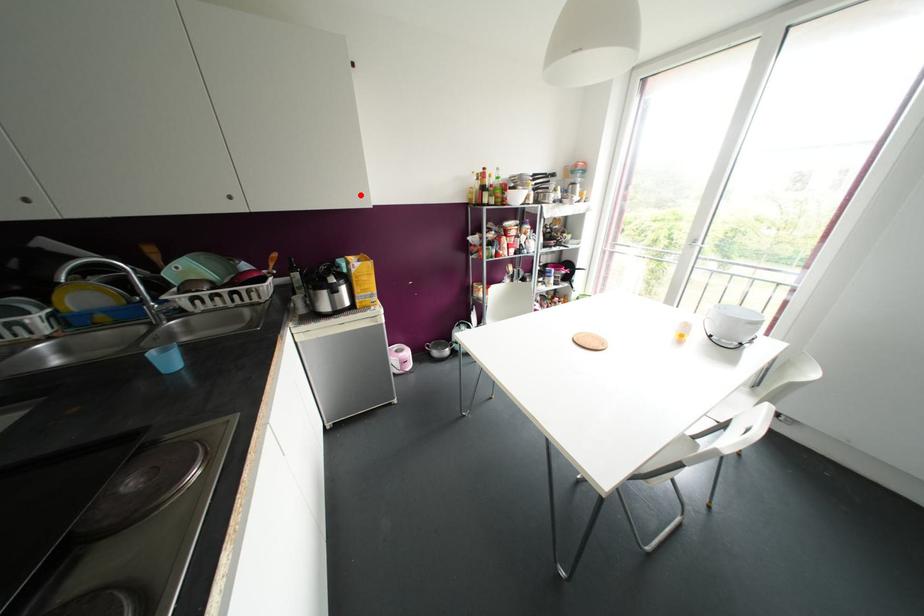
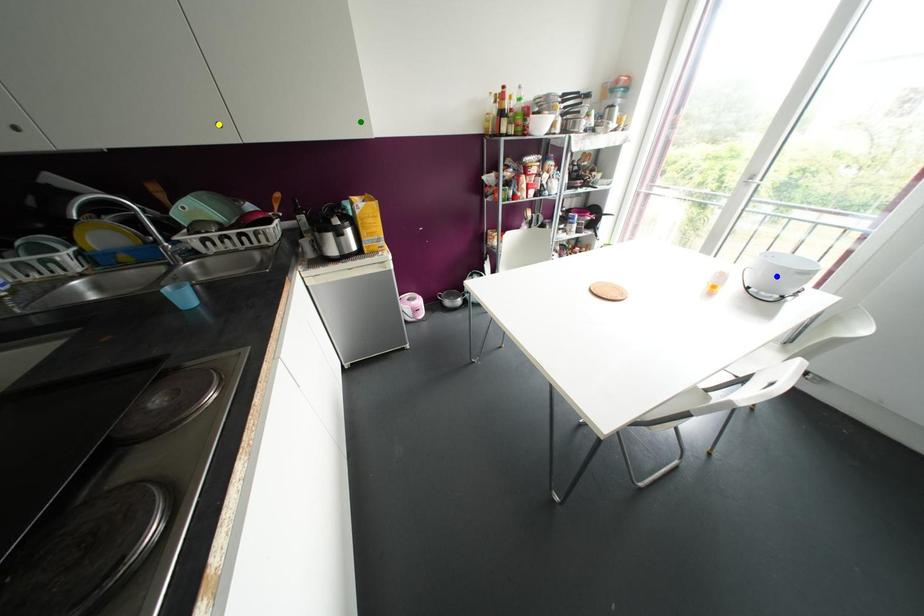
Question: I am providing you with two images of the same scene from different viewpoints. A red point is marked on the first image. You are given multiple points on the second image. Which mark in image 2 goes with the point in image 1?

Choices:
 (A) green point
 (B) blue point
 (C) yellow point

Answer: (A)